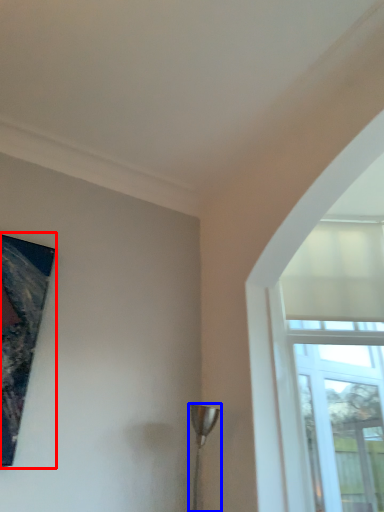
Question: Which object appears farthest to the camera in this image, picture frame (highlighted by a red box) or lamp (highlighted by a blue box)?

Choices:
 (A) picture frame
 (B) lamp

Answer: (B)